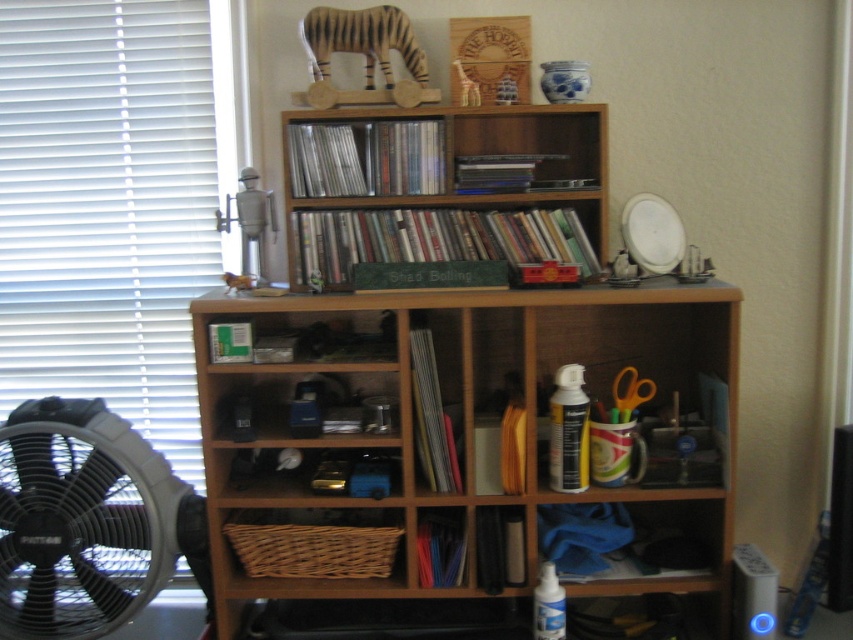
You are standing in front of the wooden shelving unit and want to place a new item on the shelf. You have two options for placement based on coordinates given as points. The first point is at coordinates point (561,202) and the second is at point (161,461). Which point is closer to the wall?

Point (561,202) is behind point (161,461), so it is closer to the wall.